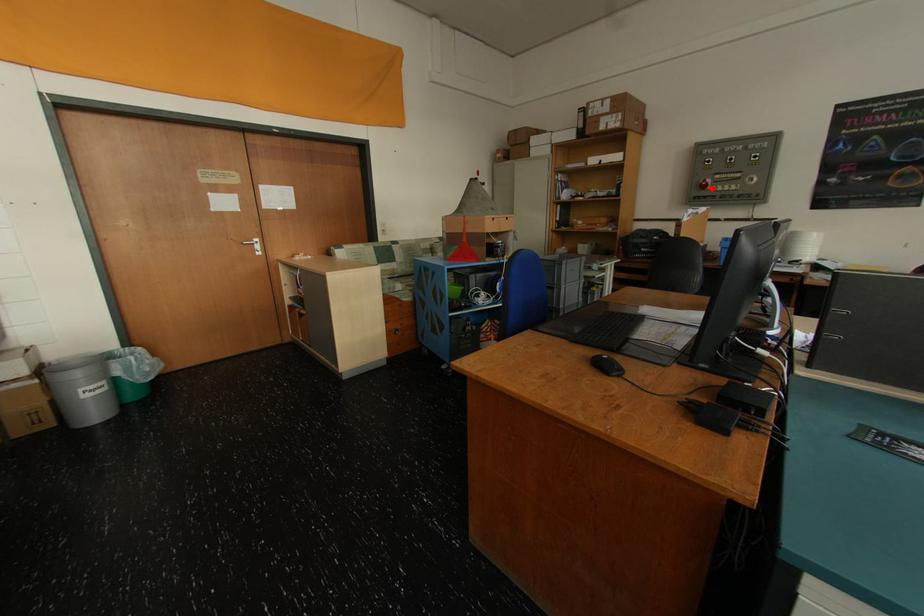
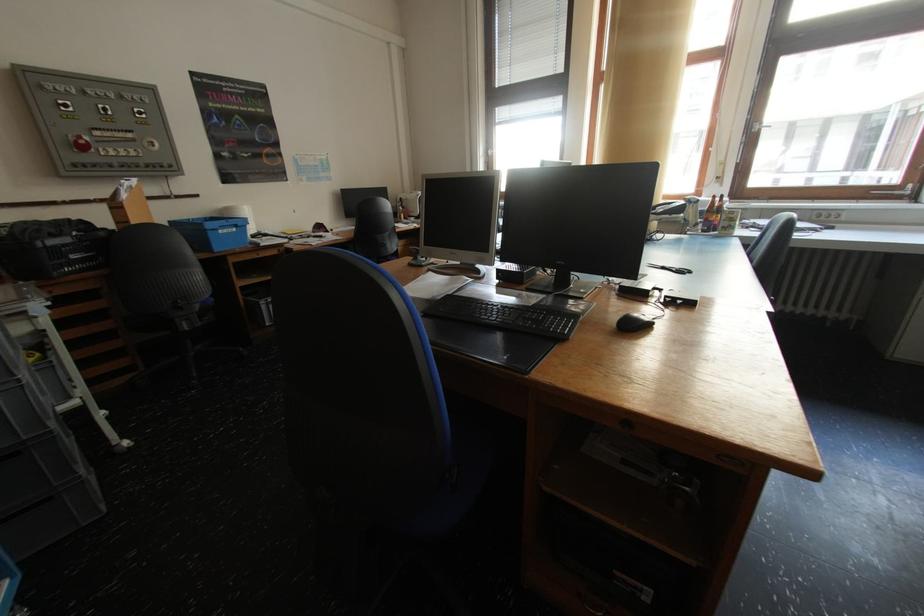
In the second image, find the point that corresponds to the highlighted location in the first image.

(91, 148)